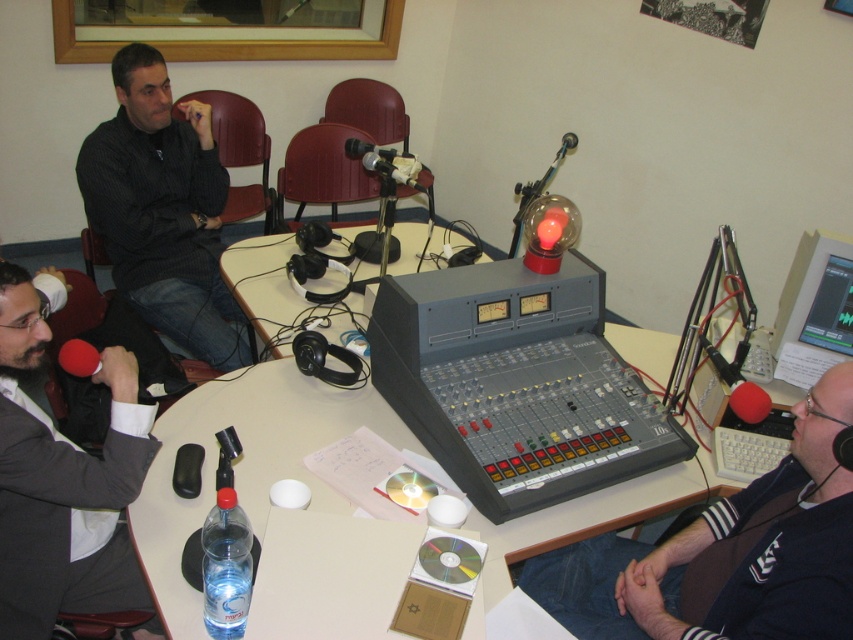
Question: Which point appears farthest from the camera in this image?

Choices:
 (A) (106, 145)
 (B) (108, 435)

Answer: (A)

Question: Is black matte microphone at lower right wider than black striped shirt at upper left?

Choices:
 (A) no
 (B) yes

Answer: (A)

Question: Which is nearer to the black striped shirt at upper left?

Choices:
 (A) gray suit jacket at left
 (B) black matte microphone at lower right

Answer: (A)

Question: Does black matte microphone at lower right have a larger size compared to black striped shirt at upper left?

Choices:
 (A) yes
 (B) no

Answer: (B)

Question: Among these points, which one is farthest from the camera?

Choices:
 (A) (144, 445)
 (B) (368, 419)
 (C) (126, 268)
 (D) (833, 374)

Answer: (C)

Question: Does gray suit jacket at left appear on the left side of black striped shirt at upper left?

Choices:
 (A) yes
 (B) no

Answer: (B)